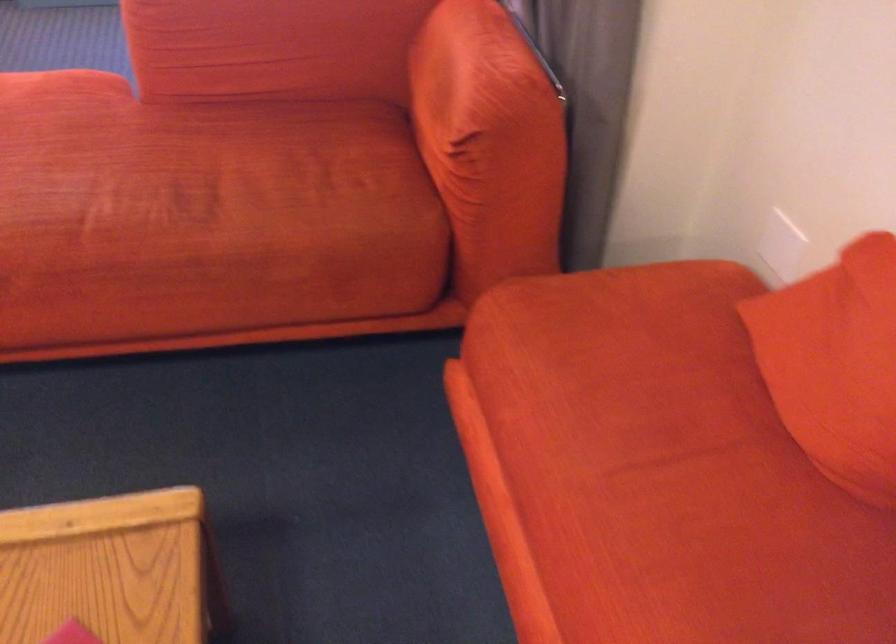
You are a GUI agent. You are given a task and a screenshot of the screen. Output one action in this format:
    pyautogui.click(x=<x>, y=<y>)
    Task: Click on the red sofa cushion
    This screenshot has height=644, width=896.
    Given the screenshot: What is the action you would take?
    pyautogui.click(x=834, y=359)